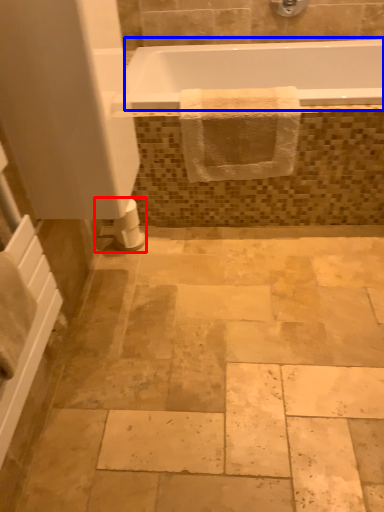
Question: Which of the following is the closest to the observer, toilet paper (highlighted by a red box) or bathtub (highlighted by a blue box)?

Choices:
 (A) toilet paper
 (B) bathtub

Answer: (B)